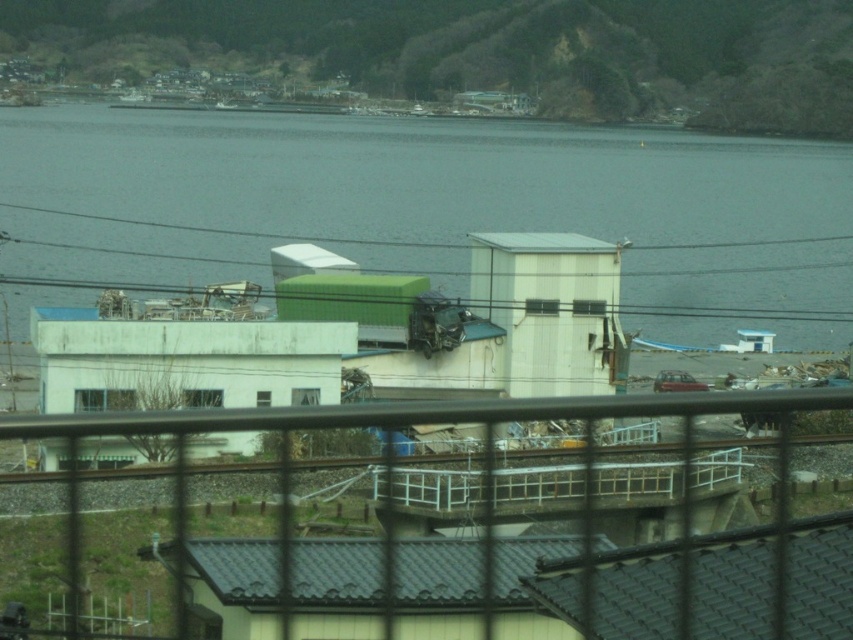
You are standing outside looking through a window with a grid pattern. You see a white matte building at center and a green matte power line at center. Which object is closer to you?

The white matte building at center is closer to you because it is in front of the green matte power line at center.

Looking at this image, you are standing at the window and want to know which object is larger between the white matte building at center and the metallic wire fence at center. Can you determine this based on the view?

The white matte building at center is bigger than the metallic wire fence at center, so the white matte building at center is larger.

You are an engineer assessing the structural integrity of the metallic wire fence at center and the green matte power line at center. Which object has a narrower width?

The metallic wire fence at center has a narrower width than the green matte power line at center.